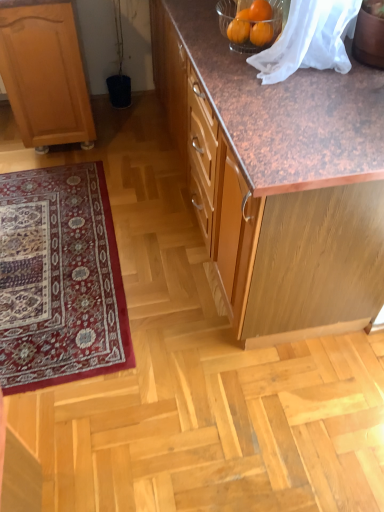
Question: From a real-world perspective, is carpeted rug at lower left physically located above or below brown wood cabinet at center, which is counted as the 2th cabinetry, starting from the left?

Choices:
 (A) above
 (B) below

Answer: (B)

Question: Is carpeted rug at lower left bigger or smaller than brown wood cabinet at center, which is counted as the 2th cabinetry, starting from the left?

Choices:
 (A) small
 (B) big

Answer: (A)

Question: Which object is the closest to the orange matte at upper center, acting as the second orange starting from the top?

Choices:
 (A) light brown wood cabinet at left, the 1th cabinetry from the left
 (B) brown wood cabinet at center, the 1th cabinetry positioned from the right
 (C) orange matte at upper right, marked as the 2th orange in a bottom-to-top arrangement
 (D) carpeted rug at lower left

Answer: (C)

Question: Which of these objects is positioned closest to the orange matte at upper right, the 1th orange when ordered from top to bottom?

Choices:
 (A) orange matte at upper center, acting as the second orange starting from the top
 (B) brown wood cabinet at center, the 1th cabinetry positioned from the right
 (C) carpeted rug at lower left
 (D) light brown wood cabinet at left, the 1th cabinetry from the left

Answer: (A)